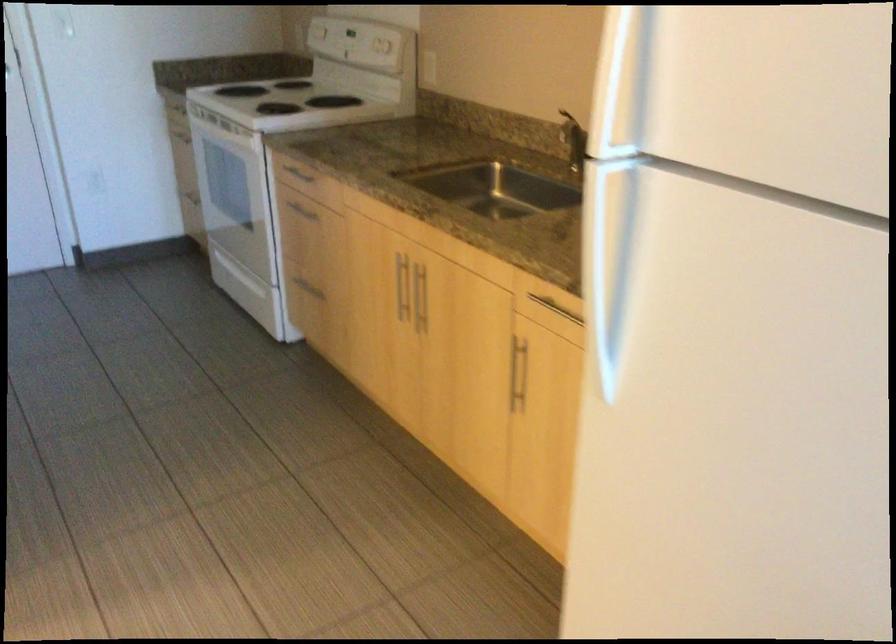
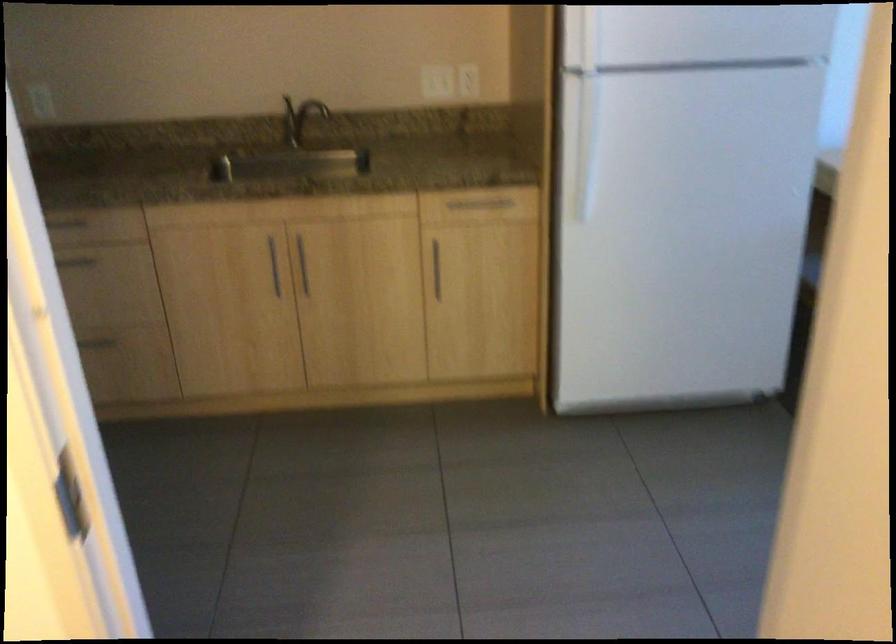
Where in the second image is the point corresponding to pixel 520 370 from the first image?

(435, 269)